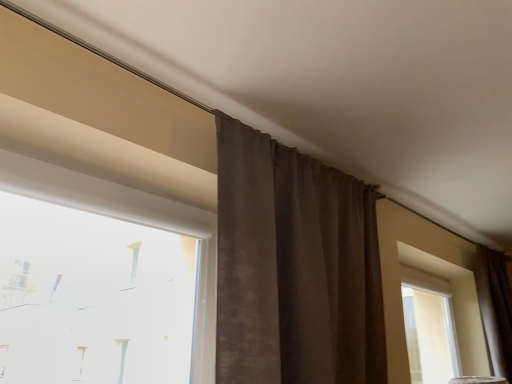
Question: Is white plastic window at upper left further to camera compared to brown textured curtain at center, positioned as the 1th curtain in front-to-back order?

Choices:
 (A) yes
 (B) no

Answer: (B)

Question: Can we say white plastic window at upper left lies outside brown textured curtain at center, which is counted as the 2th curtain, starting from the right?

Choices:
 (A) yes
 (B) no

Answer: (A)

Question: Is white plastic window at upper left at the left side of brown textured curtain at center, the second curtain from the back?

Choices:
 (A) yes
 (B) no

Answer: (A)

Question: Is white plastic window at upper left aimed at brown textured curtain at center, which is counted as the 2th curtain, starting from the right?

Choices:
 (A) no
 (B) yes

Answer: (A)

Question: Are white plastic window at upper left and brown textured curtain at center, the second curtain from the back, far apart?

Choices:
 (A) yes
 (B) no

Answer: (B)

Question: Is the position of white plastic window at upper left less distant than that of brown textured curtain at center, which is counted as the 2th curtain, starting from the right?

Choices:
 (A) no
 (B) yes

Answer: (B)

Question: Is brown textured curtain at center, which is counted as the 2th curtain, starting from the right, beside white plastic window at upper left?

Choices:
 (A) yes
 (B) no

Answer: (B)

Question: From a real-world perspective, is brown textured curtain at center, the second curtain from the back, physically above white plastic window at upper left?

Choices:
 (A) no
 (B) yes

Answer: (B)

Question: Is brown textured curtain at center, which is counted as the 2th curtain, starting from the right, completely or partially outside of white plastic window at upper left?

Choices:
 (A) yes
 (B) no

Answer: (A)

Question: Is brown textured curtain at center, positioned as the 1th curtain in front-to-back order, far from white plastic window at upper left?

Choices:
 (A) yes
 (B) no

Answer: (B)

Question: Is white plastic window at upper left located within brown textured curtain at center, which is counted as the 2th curtain, starting from the right?

Choices:
 (A) no
 (B) yes

Answer: (A)

Question: Does brown textured curtain at center, which is counted as the 2th curtain, starting from the right, appear on the right side of white plastic window at upper left?

Choices:
 (A) no
 (B) yes

Answer: (B)

Question: Is brown textured curtain at right, which is counted as the first curtain, starting from the back, taller than brown textured curtain at center, the second curtain from the back?

Choices:
 (A) yes
 (B) no

Answer: (B)